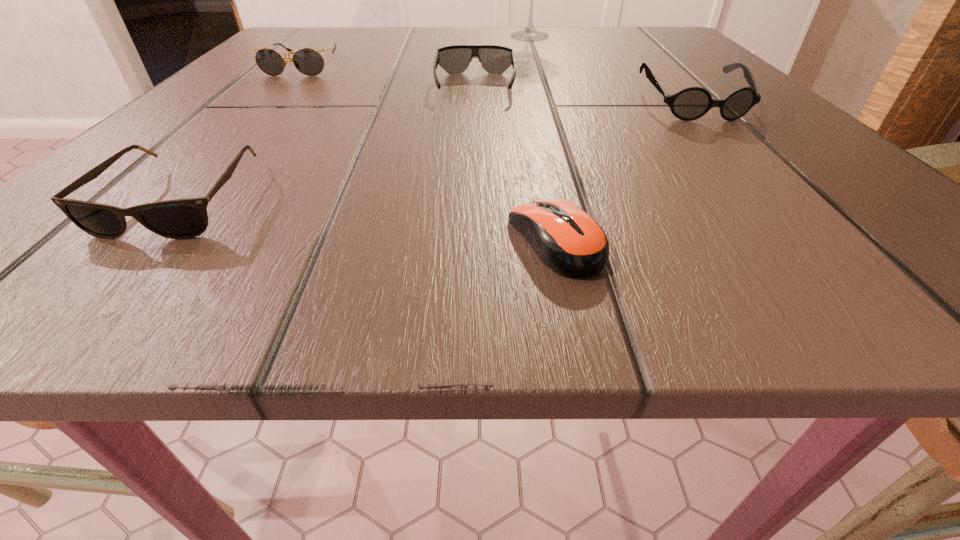
This screenshot has height=540, width=960. I want to click on the tallest object, so click(530, 33).

Where is `the farthest object`? This screenshot has height=540, width=960. the farthest object is located at coordinates (530, 33).

I want to click on the rightmost object, so click(x=691, y=103).

Image resolution: width=960 pixels, height=540 pixels. Find the location of `the third sunglasses from left to right`. the third sunglasses from left to right is located at coordinates (455, 59).

At what (x,y) coordinates should I click in order to perform the action: click on the nearest sunglasses. Please return your answer as a coordinate pair (x, y). The height and width of the screenshot is (540, 960). Looking at the image, I should click on (187, 218).

You are a GUI agent. You are given a task and a screenshot of the screen. Output one action in this format:
    pyautogui.click(x=<x>, y=<y>)
    Task: Click on the shortest object
    The height and width of the screenshot is (540, 960).
    Given the screenshot: What is the action you would take?
    (x=570, y=242)

Find the location of a particular element. The height and width of the screenshot is (540, 960). vacant space located 0.250m on the left of the farthest object is located at coordinates (374, 36).

Find the location of `free point located 0.250m on the lenses of the rightmost object`. free point located 0.250m on the lenses of the rightmost object is located at coordinates click(x=825, y=243).

Image resolution: width=960 pixels, height=540 pixels. Identify the location of vacant space located 0.340m on the front-facing side of the third sunglasses from left to right. (471, 256).

This screenshot has height=540, width=960. What are the coordinates of `free space located 0.170m on the right of the computer mouse` in the screenshot? It's located at (796, 240).